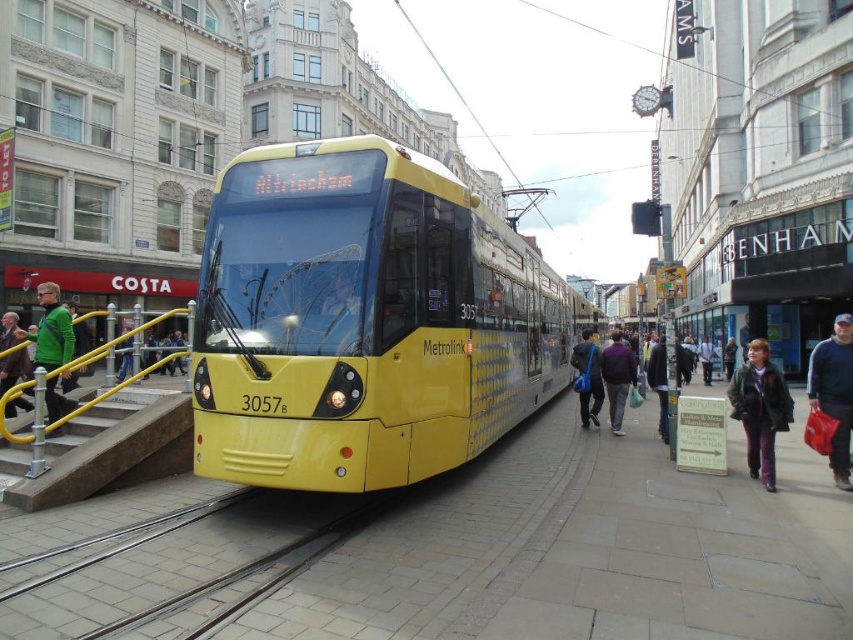
You are a passenger on the Metrolink tram 3057 heading to Altrincham. You notice two jackets hanging on the rack behind you. Which jacket is closer to the floor, the dark blue fabric jacket at lower right or the green fabric jacket at left?

The dark blue fabric jacket at lower right is positioned under the green fabric jacket at left, so the dark blue fabric jacket at lower right is closer to the floor.

You are a passenger standing inside the Metrolink tram 3057 heading to Altrincham. You see a green fuzzy coat at lower right and a green fabric jacket at left. Which item is closer to you?

The green fuzzy coat at lower right is closer to you since it is further to the viewer than the green fabric jacket at left.